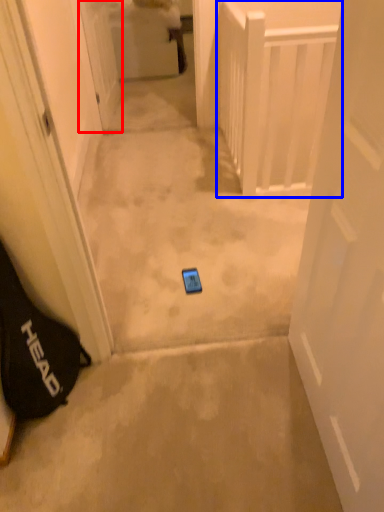
Question: Which point is further to the camera, door (highlighted by a red box) or balustrade (highlighted by a blue box)?

Choices:
 (A) door
 (B) balustrade

Answer: (A)